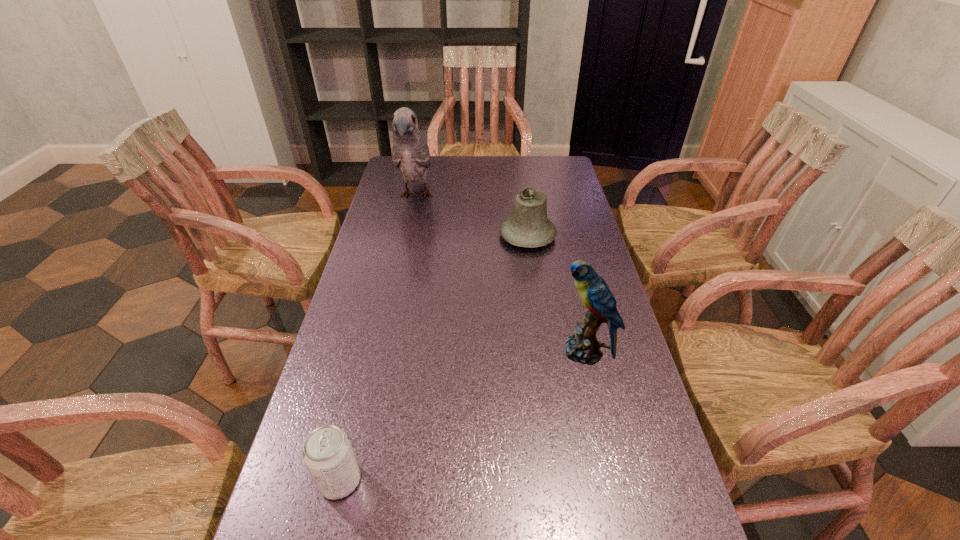
Identify the location of vacant region located 0.190m on the face of the nearer parrot. The width and height of the screenshot is (960, 540). (480, 352).

The width and height of the screenshot is (960, 540). Find the location of `free space located on the face of the nearer parrot`. free space located on the face of the nearer parrot is located at coordinates (394, 352).

Where is `free point located 0.150m on the front of the second shortest object`? free point located 0.150m on the front of the second shortest object is located at coordinates (535, 286).

You are a GUI agent. You are given a task and a screenshot of the screen. Output one action in this format:
    pyautogui.click(x=<x>, y=<y>)
    Task: Click on the free region located on the left of the shortest object
    This screenshot has height=540, width=960.
    Given the screenshot: What is the action you would take?
    pyautogui.click(x=287, y=480)

Where is `object that is at the far edge`? object that is at the far edge is located at coordinates (411, 154).

Locate an element on the screen. parrot that is at the left edge is located at coordinates (411, 154).

The image size is (960, 540). I want to click on soda can situated at the left edge, so 327,453.

Find the location of a particular element. The image size is (960, 540). parrot located at the right edge is located at coordinates click(582, 346).

This screenshot has width=960, height=540. What are the coordinates of `bell located at the right edge` in the screenshot? It's located at (528, 226).

You are a GUI agent. You are given a task and a screenshot of the screen. Output one action in this format:
    pyautogui.click(x=<x>, y=<y>)
    Task: Click on the object positioned at the far left corner
    The width and height of the screenshot is (960, 540).
    Given the screenshot: What is the action you would take?
    pyautogui.click(x=411, y=154)